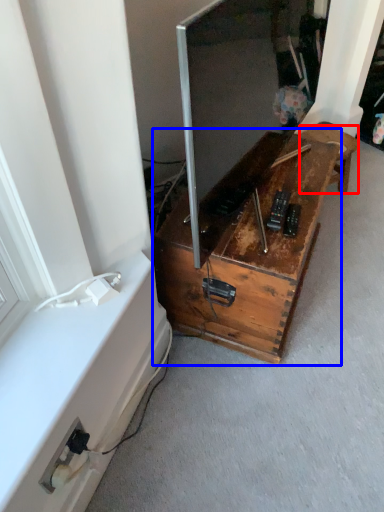
Question: Which point is closer to the camera, furniture (highlighted by a red box) or furniture (highlighted by a blue box)?

Choices:
 (A) furniture
 (B) furniture

Answer: (B)